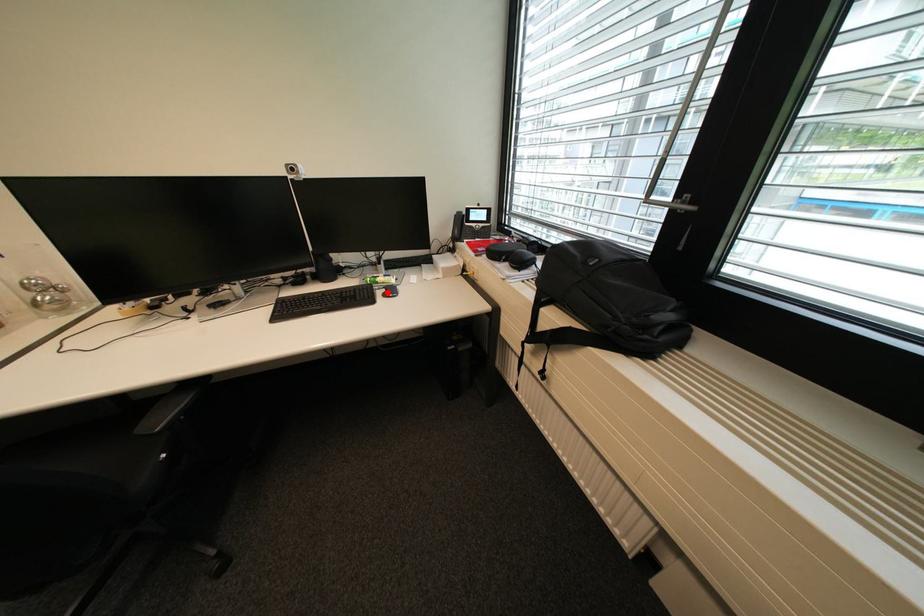
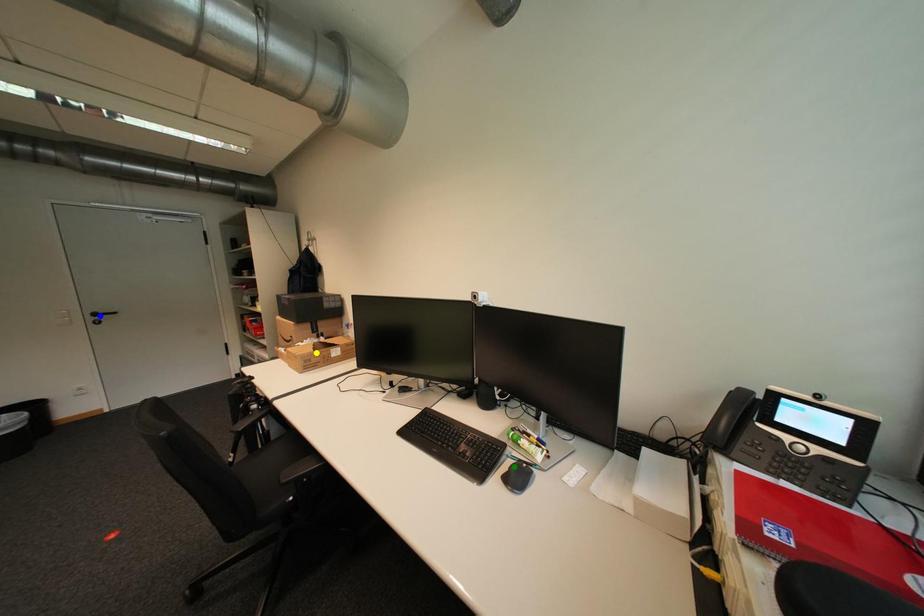
Question: I am providing you with two images of the same scene from different viewpoints. A red point is marked on the first image. You are given multiple points on the second image. Which point in image 2 is actually the same real-world point as the red point in image 1?

Choices:
 (A) yellow point
 (B) green point
 (C) blue point

Answer: (B)